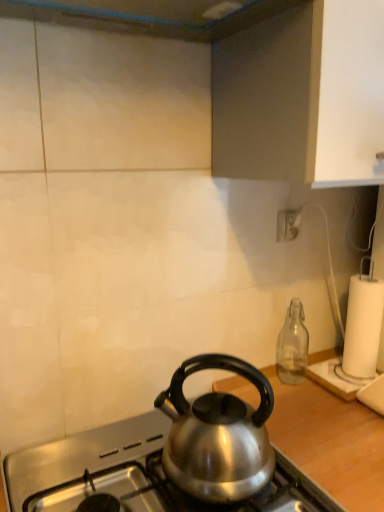
Question: In terms of width, does transparent glass bottle at right look wider or thinner when compared to shiny metallic kettle at center?

Choices:
 (A) thin
 (B) wide

Answer: (A)

Question: In the image, is transparent glass bottle at right on the left side or the right side of shiny metallic kettle at center?

Choices:
 (A) left
 (B) right

Answer: (A)

Question: Based on their relative distances, which object is farther from the transparent glass bottle at right?

Choices:
 (A) satin silver kettle at center
 (B) satin silver kettle at center
 (C) shiny metallic kettle at center
 (D) white plastic power outlet at upper right
 (E) white paper at right

Answer: (B)

Question: Based on their relative distances, which object is nearer to the transparent glass bottle at right?

Choices:
 (A) satin silver kettle at center
 (B) shiny metallic kettle at center
 (C) satin silver kettle at center
 (D) white paper at right
 (E) white plastic power outlet at upper right

Answer: (D)